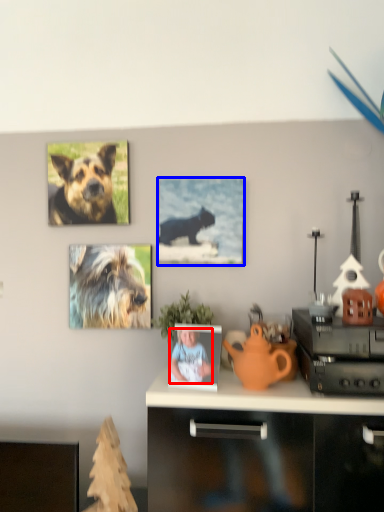
Question: Among these objects, which one is farthest to the camera, person (highlighted by a red box) or picture frame (highlighted by a blue box)?

Choices:
 (A) person
 (B) picture frame

Answer: (B)